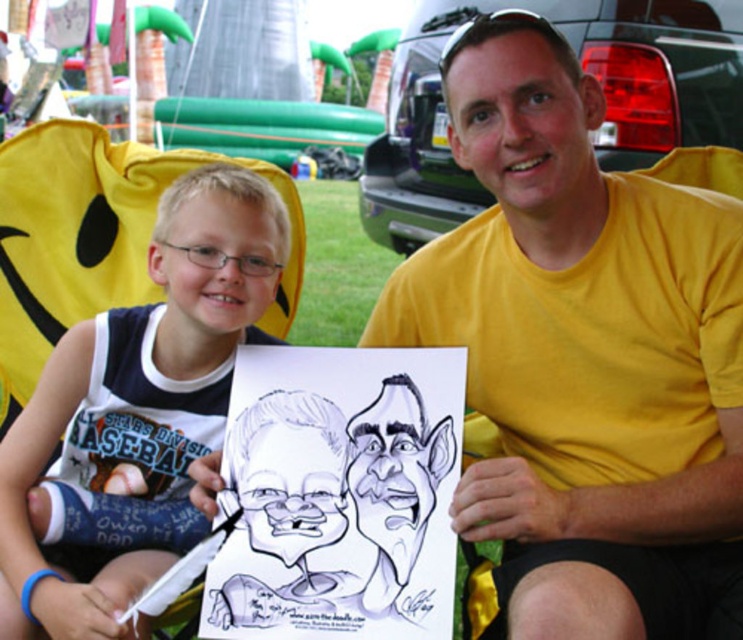
Question: Is the position of yellow t-shirt at center less distant than that of white paper at center?

Choices:
 (A) no
 (B) yes

Answer: (B)

Question: Among these points, which one is farthest from the camera?

Choices:
 (A) (152, 564)
 (B) (559, 420)

Answer: (B)

Question: Among these points, which one is nearest to the camera?

Choices:
 (A) (256, 262)
 (B) (568, 198)

Answer: (B)

Question: Considering the relative positions of yellow t-shirt at center and white paper at center in the image provided, where is yellow t-shirt at center located with respect to white paper at center?

Choices:
 (A) below
 (B) above

Answer: (B)

Question: Considering the relative positions of yellow t-shirt at center and white paper at center in the image provided, where is yellow t-shirt at center located with respect to white paper at center?

Choices:
 (A) right
 (B) left

Answer: (A)

Question: Which point is farther to the camera?

Choices:
 (A) yellow t-shirt at center
 (B) white paper at center

Answer: (B)